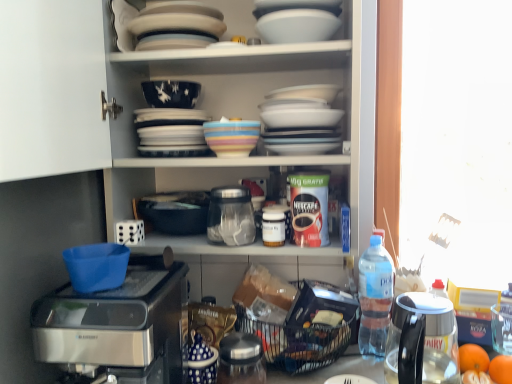
Question: From a real-world perspective, is white glossy bowl at upper center, which ranks as the 1th tableware in top-to-bottom order, located higher than metallic silver jar at lower center, placed as the 1th appliance when sorted from bottom to top?

Choices:
 (A) yes
 (B) no

Answer: (A)

Question: Is white glossy bowl at upper center, which ranks as the 1th tableware in top-to-bottom order, to the left of metallic silver jar at lower center, positioned as the third appliance in top-to-bottom order, from the viewer's perspective?

Choices:
 (A) yes
 (B) no

Answer: (B)

Question: Can you confirm if white glossy bowl at upper center, which ranks as the 1th tableware in top-to-bottom order, is positioned to the right of metallic silver jar at lower center, placed as the 1th appliance when sorted from bottom to top?

Choices:
 (A) yes
 (B) no

Answer: (A)

Question: Could metallic silver jar at lower center, positioned as the third appliance in top-to-bottom order, be considered to be inside white glossy bowl at upper center, which ranks as the 1th tableware in top-to-bottom order?

Choices:
 (A) no
 (B) yes

Answer: (A)

Question: Can you confirm if white glossy bowl at upper center, positioned as the third tableware in bottom-to-top order, is wider than metallic silver jar at lower center, positioned as the third appliance in top-to-bottom order?

Choices:
 (A) no
 (B) yes

Answer: (A)

Question: From a real-world perspective, relative to metallic silver jar at lower center, positioned as the third appliance in top-to-bottom order, is clear plastic bottle at right, positioned as the second bottle in top-to-bottom order, vertically above or below?

Choices:
 (A) below
 (B) above

Answer: (B)

Question: Based on their positions, is clear plastic bottle at right, positioned as the second bottle in top-to-bottom order, located to the left or right of metallic silver jar at lower center, placed as the 1th appliance when sorted from bottom to top?

Choices:
 (A) right
 (B) left

Answer: (A)

Question: In terms of width, does clear plastic bottle at right, the 1th bottle from the back, look wider or thinner when compared to metallic silver jar at lower center, placed as the 1th appliance when sorted from bottom to top?

Choices:
 (A) wide
 (B) thin

Answer: (B)

Question: Choose the correct answer: Is clear plastic bottle at right, the second bottle when ordered from left to right, inside metallic silver jar at lower center, placed as the 1th appliance when sorted from bottom to top, or outside it?

Choices:
 (A) inside
 (B) outside

Answer: (B)

Question: Relative to black plastic basket at lower center, is white glossy bowl at upper center, which ranks as the 1th tableware in top-to-bottom order, in front or behind?

Choices:
 (A) front
 (B) behind

Answer: (A)

Question: Does point (314, 21) appear closer or farther from the camera than point (328, 357)?

Choices:
 (A) closer
 (B) farther

Answer: (A)

Question: From a real-world perspective, is white glossy bowl at upper center, which ranks as the 1th tableware in top-to-bottom order, above or below black plastic basket at lower center?

Choices:
 (A) below
 (B) above

Answer: (B)

Question: In terms of height, does white glossy bowl at upper center, which ranks as the 1th tableware in top-to-bottom order, look taller or shorter compared to black plastic basket at lower center?

Choices:
 (A) short
 (B) tall

Answer: (A)

Question: Considering the positions of white glossy bowl at lower center, the first tableware positioned from the bottom, and orange matte at lower right, arranged as the 2th tangerine when viewed from the front, in the image, is white glossy bowl at lower center, the first tableware positioned from the bottom, taller or shorter than orange matte at lower right, arranged as the 2th tangerine when viewed from the front,?

Choices:
 (A) tall
 (B) short

Answer: (B)

Question: Based on their sizes in the image, would you say white glossy bowl at lower center, the third tableware in the top-to-bottom sequence, is bigger or smaller than orange matte at lower right, the first tangerine positioned from the back?

Choices:
 (A) big
 (B) small

Answer: (A)